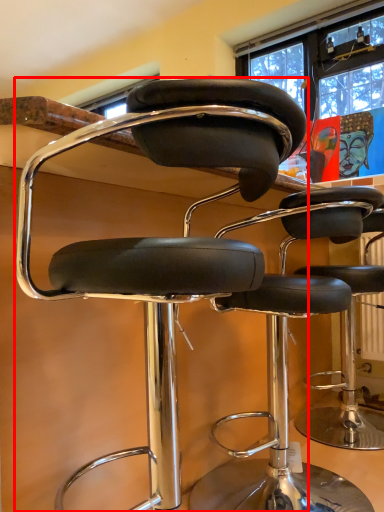
Question: From the image's perspective, where is chair (annotated by the red box) located relative to chair?

Choices:
 (A) below
 (B) above

Answer: (B)